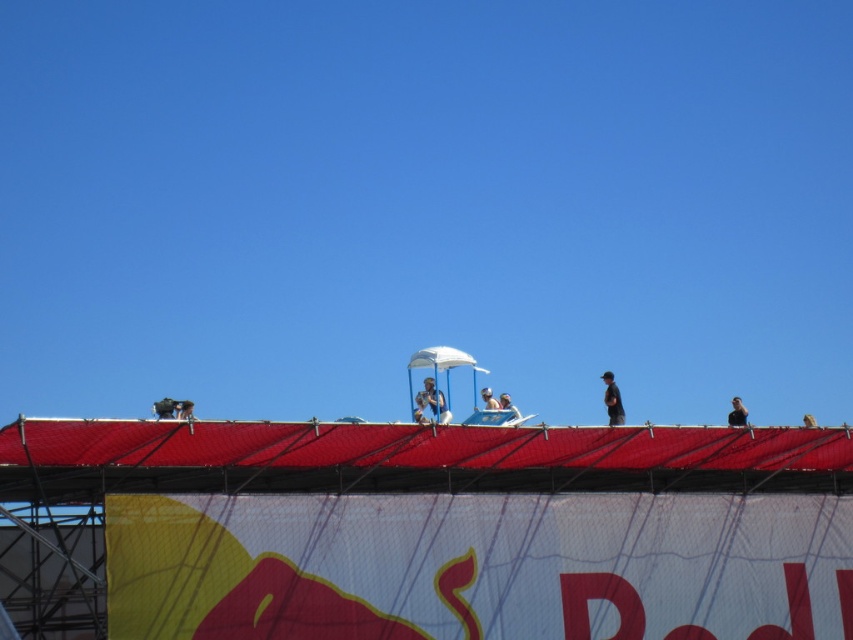
Question: Estimate the real-world distances between objects in this image. Which object is farther from the matte black helmet at upper center?

Choices:
 (A) black matte person at upper right
 (B) light blue fabric umbrella at center
 (C) metallic silver helmet at center

Answer: (B)

Question: Which object is the farthest from the white matte helmet at upper center?

Choices:
 (A) black matte person at upper right
 (B) metallic helmet at upper center
 (C) white fabric umbrella at upper center

Answer: (B)

Question: Is white matte helmet at upper center thinner than white fabric umbrella at upper center?

Choices:
 (A) yes
 (B) no

Answer: (A)

Question: Among these points, which one is nearest to the camera?

Choices:
 (A) (424, 403)
 (B) (491, 404)
 (C) (730, 426)

Answer: (C)

Question: Does light blue fabric umbrella at center appear on the left side of matte black helmet at upper center?

Choices:
 (A) no
 (B) yes

Answer: (B)

Question: Can you confirm if metallic silver helmet at center is positioned to the right of black fabric person at upper center?

Choices:
 (A) yes
 (B) no

Answer: (B)